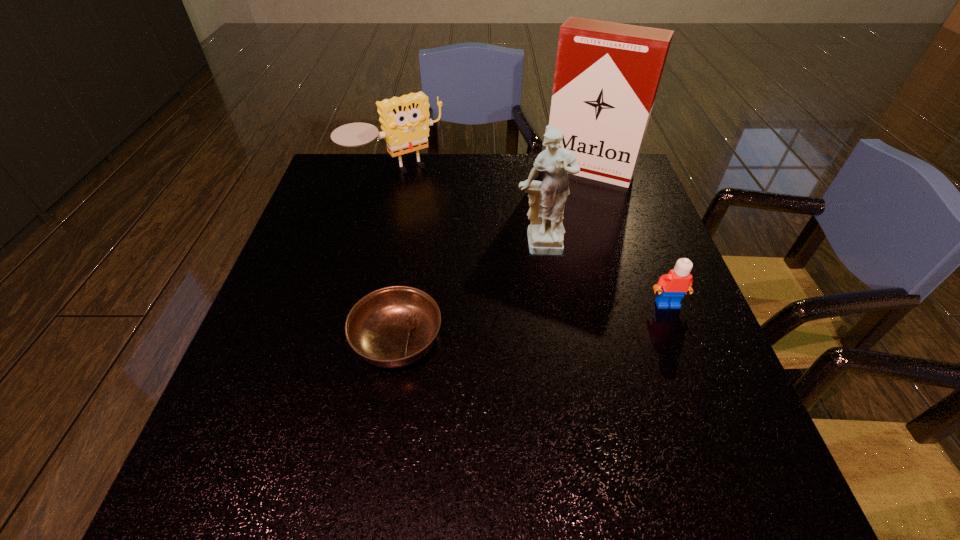
This screenshot has height=540, width=960. What are the coordinates of `free spot that satisfies the following two spatial constraints: 1. on the front side of the sponge; 2. on the right side of the soup bowl` in the screenshot? It's located at (354, 340).

This screenshot has height=540, width=960. I want to click on vacant position in the image that satisfies the following two spatial constraints: 1. on the front side of the shortest object; 2. on the right side of the sponge, so click(x=354, y=340).